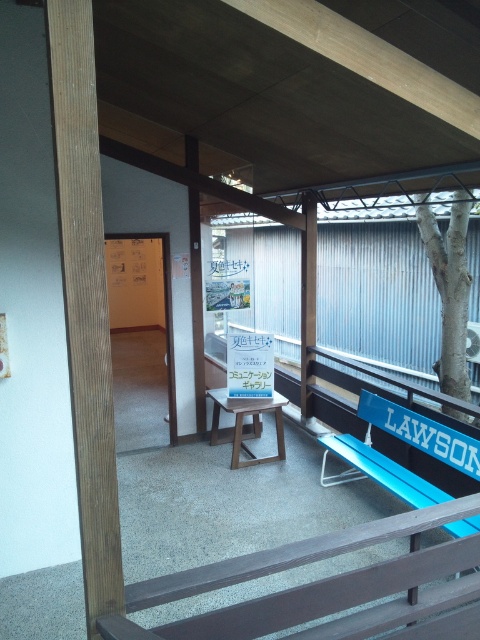
Question: Which object is the closest to the blue plastic bench at right?

Choices:
 (A) white textured tree at right
 (B) brown wood at left

Answer: (A)

Question: Observing the image, what is the correct spatial positioning of brown wood at left in reference to white textured tree at right?

Choices:
 (A) left
 (B) right

Answer: (A)

Question: Does brown wood at left have a lesser width compared to white textured tree at right?

Choices:
 (A) no
 (B) yes

Answer: (B)

Question: Estimate the real-world distances between objects in this image. Which object is farther from the blue plastic bench at right?

Choices:
 (A) brown wood at left
 (B) white textured tree at right

Answer: (A)

Question: Estimate the real-world distances between objects in this image. Which object is farther from the white textured tree at right?

Choices:
 (A) brown wood at left
 (B) blue plastic bench at right

Answer: (A)

Question: Is brown wood at left positioned behind white textured tree at right?

Choices:
 (A) yes
 (B) no

Answer: (B)